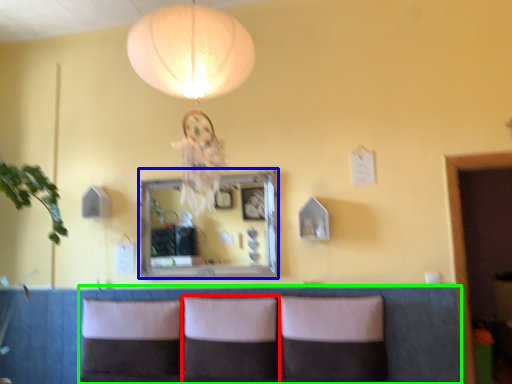
Question: Estimate the real-world distances between objects in this image. Which object is closer to pillow (highlighted by a red box), mirror (highlighted by a blue box) or couch (highlighted by a green box)?

Choices:
 (A) mirror
 (B) couch

Answer: (B)